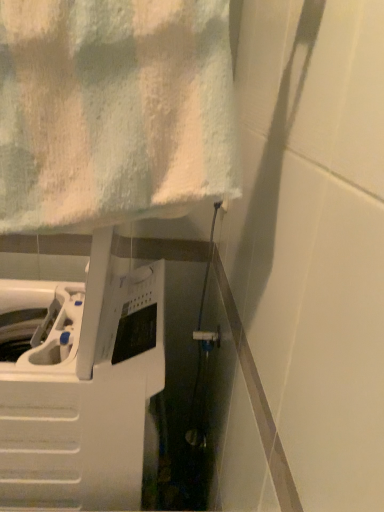
Question: Can you confirm if white plastic washing machine at left is shorter than white textured towel at upper left?

Choices:
 (A) yes
 (B) no

Answer: (B)

Question: Is white plastic washing machine at left positioned with its back to white textured towel at upper left?

Choices:
 (A) no
 (B) yes

Answer: (A)

Question: Is white plastic washing machine at left smaller than white textured towel at upper left?

Choices:
 (A) no
 (B) yes

Answer: (A)

Question: From the image's perspective, does white plastic washing machine at left appear higher than white textured towel at upper left?

Choices:
 (A) yes
 (B) no

Answer: (B)

Question: Is white plastic washing machine at left aimed at white textured towel at upper left?

Choices:
 (A) no
 (B) yes

Answer: (A)

Question: Considering the relative positions of white plastic washing machine at left and white textured towel at upper left in the image provided, is white plastic washing machine at left to the right of white textured towel at upper left from the viewer's perspective?

Choices:
 (A) yes
 (B) no

Answer: (B)

Question: Is white textured towel at upper left not near white plastic washing machine at left?

Choices:
 (A) no
 (B) yes

Answer: (A)

Question: Can you confirm if white textured towel at upper left is taller than white plastic washing machine at left?

Choices:
 (A) no
 (B) yes

Answer: (A)

Question: Does white textured towel at upper left turn towards white plastic washing machine at left?

Choices:
 (A) yes
 (B) no

Answer: (B)

Question: Can you confirm if white textured towel at upper left is shorter than white plastic washing machine at left?

Choices:
 (A) yes
 (B) no

Answer: (A)

Question: From the image's perspective, is white textured towel at upper left beneath white plastic washing machine at left?

Choices:
 (A) yes
 (B) no

Answer: (B)

Question: Is white textured towel at upper left smaller than white plastic washing machine at left?

Choices:
 (A) no
 (B) yes

Answer: (B)

Question: Considering the positions of white plastic washing machine at left and white textured towel at upper left in the image, is white plastic washing machine at left bigger or smaller than white textured towel at upper left?

Choices:
 (A) small
 (B) big

Answer: (B)